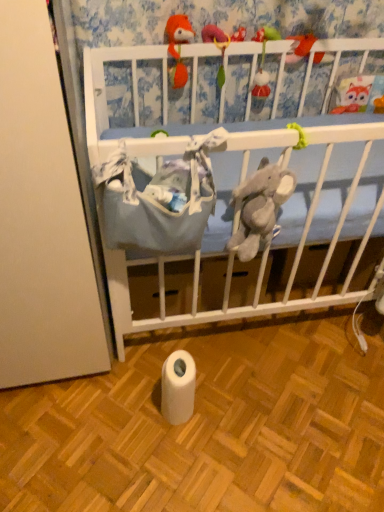
Identify the location of free space to the back side of white matte toilet paper at lower center. (191, 358).